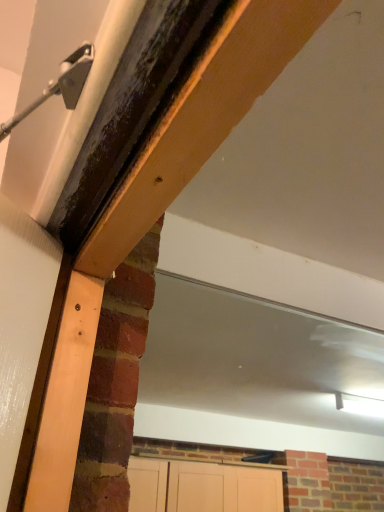
The width and height of the screenshot is (384, 512). What do you see at coordinates (201, 119) in the screenshot?
I see `wooden plank at upper center` at bounding box center [201, 119].

Where is `wooden plank at upper center`? The image size is (384, 512). wooden plank at upper center is located at coordinates (201, 119).

Where is `wooden plank at upper center`? Image resolution: width=384 pixels, height=512 pixels. wooden plank at upper center is located at coordinates (201, 119).